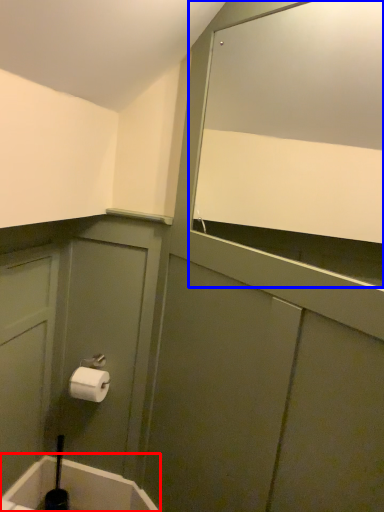
Question: Which object is further to the camera taking this photo, bath (highlighted by a red box) or mirror (highlighted by a blue box)?

Choices:
 (A) bath
 (B) mirror

Answer: (A)